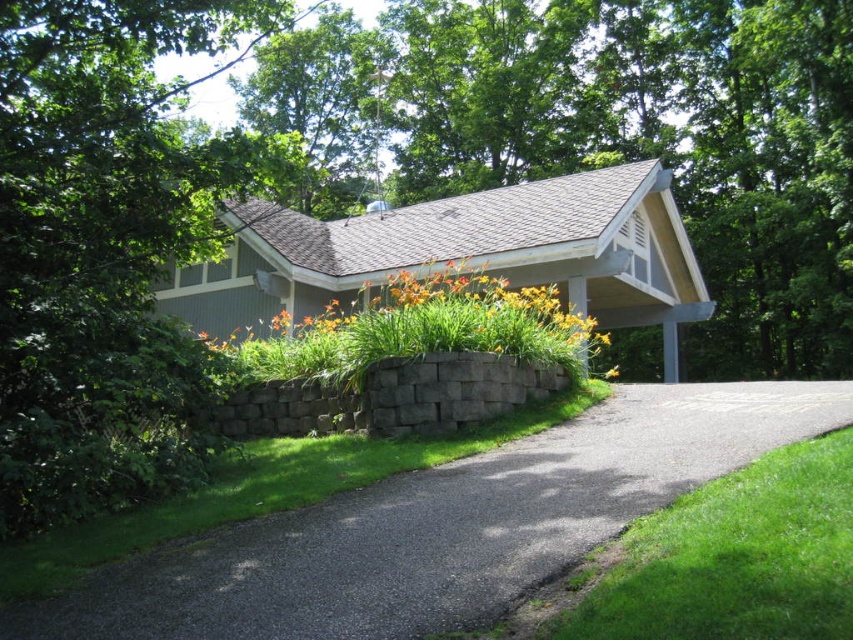
You are standing at the entrance of the covered structure in the image. If you look towards the gray asphalt driveway at center, in which direction should you walk to reach the raised stone planter filled with orange and yellow flowers?

Since the gray asphalt driveway at center is located at point (440, 525), you should walk towards the raised stone planter filled with orange and yellow flowers which is positioned in front of the structure, likely in the direction opposite to the driveway.